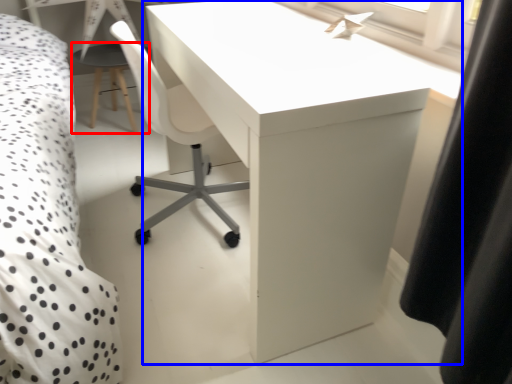
Question: Which point is further to the camera, side table (highlighted by a red box) or table (highlighted by a blue box)?

Choices:
 (A) side table
 (B) table

Answer: (A)